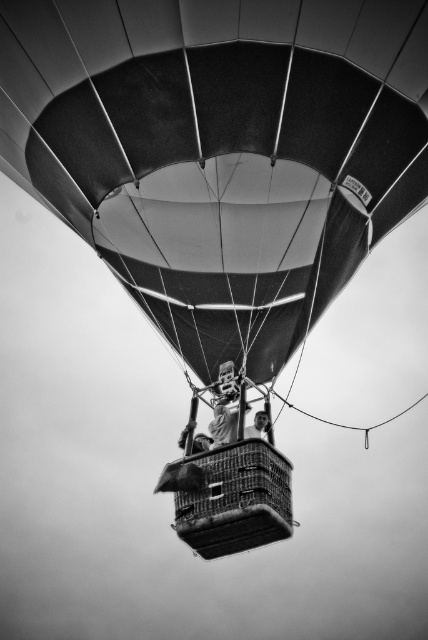
Question: Which object is farther from the camera taking this photo?

Choices:
 (A) smooth stone statue at center
 (B) matte black balloon at center
 (C) smooth skin face at center
 (D) metallic wire basket at center

Answer: (C)

Question: Does matte black balloon at center have a greater width compared to smooth stone statue at center?

Choices:
 (A) no
 (B) yes

Answer: (B)

Question: Estimate the real-world distances between objects in this image. Which object is closer to the metallic wire basket at center?

Choices:
 (A) smooth stone statue at center
 (B) smooth skin face at center

Answer: (A)

Question: Can you confirm if metallic wire basket at center is positioned to the left of smooth stone statue at center?

Choices:
 (A) yes
 (B) no

Answer: (B)

Question: Considering the relative positions of metallic wire basket at center and smooth skin face at center in the image provided, where is metallic wire basket at center located with respect to smooth skin face at center?

Choices:
 (A) below
 (B) above

Answer: (A)

Question: Which point appears farthest from the camera in this image?

Choices:
 (A) (163, 40)
 (B) (205, 474)
 (C) (259, 435)

Answer: (C)